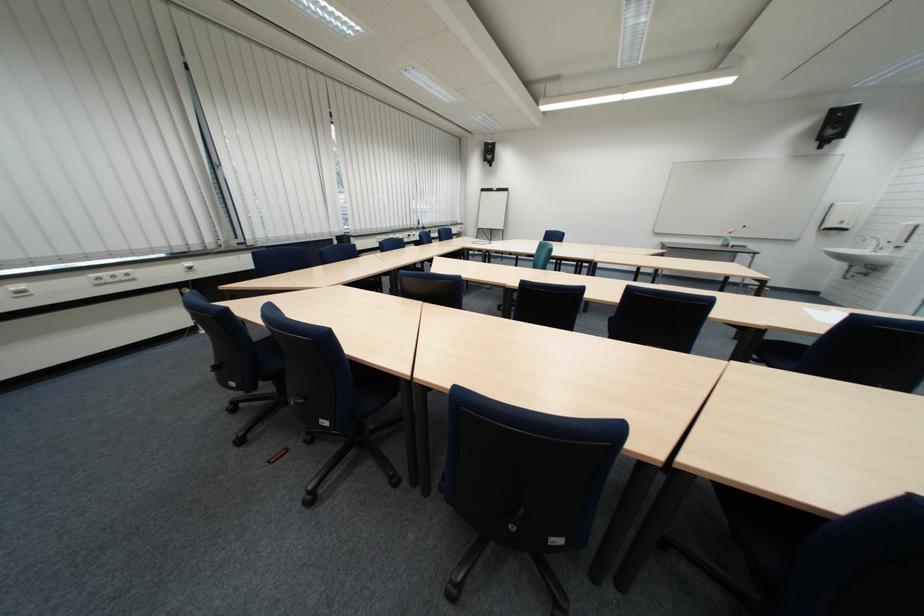
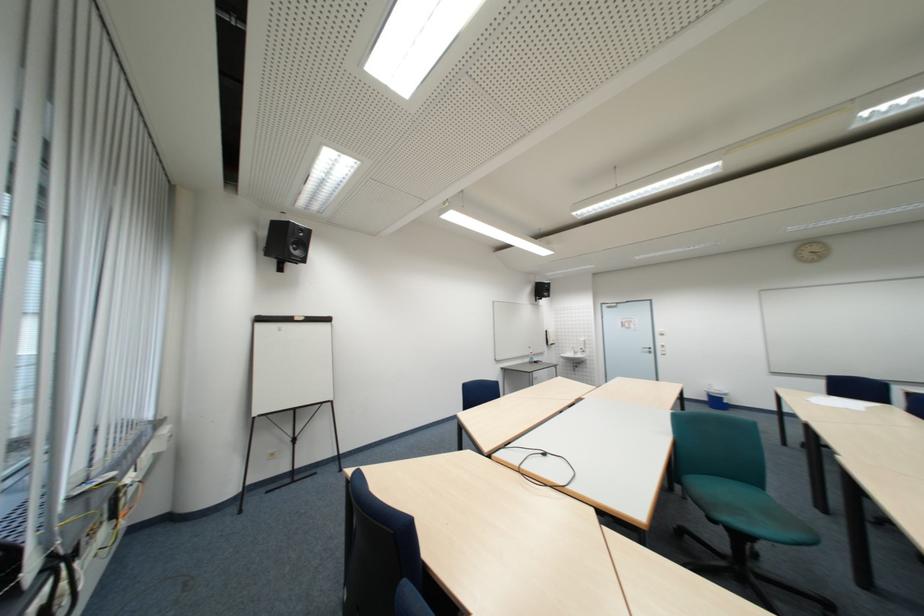
Find the pixel in the second image that matches [495,191] in the first image.

(273, 321)